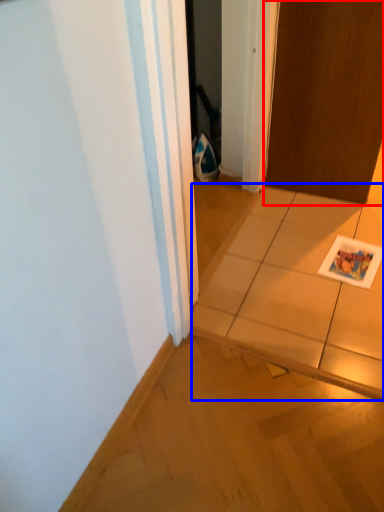
Question: Which of the following is the farthest to the observer, door (highlighted by a red box) or tile (highlighted by a blue box)?

Choices:
 (A) door
 (B) tile

Answer: (A)